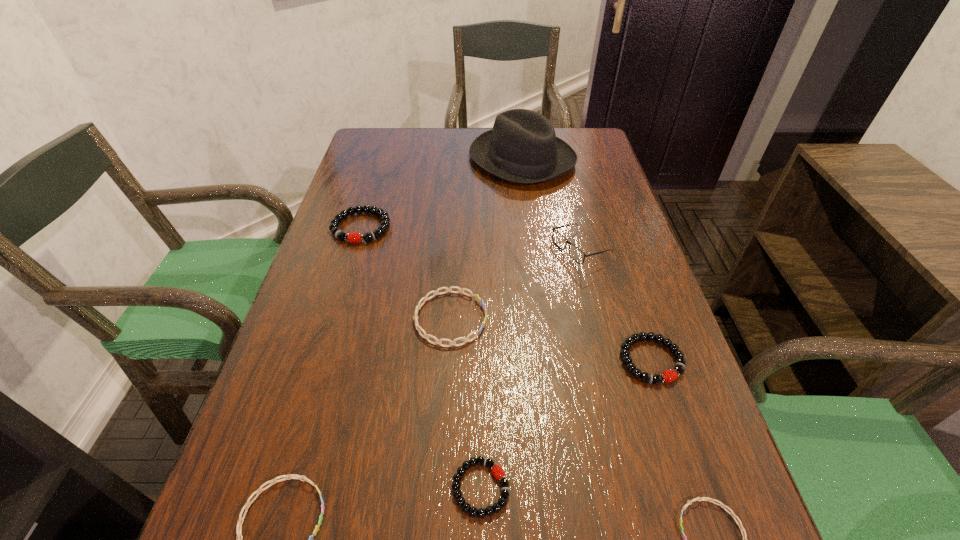
Locate an element on the screen. The width and height of the screenshot is (960, 540). empty location between the rightmost black bracelet and the second blue bracelet from right to left is located at coordinates (551, 340).

Where is `free space between the spectacles and the second smallest black bracelet`? The height and width of the screenshot is (540, 960). free space between the spectacles and the second smallest black bracelet is located at coordinates (615, 305).

Locate an element on the screen. Image resolution: width=960 pixels, height=540 pixels. free space between the second blue bracelet from right to left and the tallest object is located at coordinates (486, 239).

Locate which object is the closest to the second tallest object. Please provide its 2D coordinates. Your answer should be formatted as a tuple, i.e. [(x, y)], where the tuple contains the x and y coordinates of a point satisfying the conditions above.

[(426, 336)]

This screenshot has width=960, height=540. I want to click on the fifth closest object to the shortest bracelet, so click(291, 476).

The height and width of the screenshot is (540, 960). Find the location of `bracelet that is the sixth closest to the fedora`. bracelet that is the sixth closest to the fedora is located at coordinates (721, 504).

Where is `bracelet that is the second closest to the spectacles`? The width and height of the screenshot is (960, 540). bracelet that is the second closest to the spectacles is located at coordinates [668, 376].

Image resolution: width=960 pixels, height=540 pixels. I want to click on black bracelet that is the third closest to the fedora, so click(x=497, y=471).

Identify which black bracelet is the second nearest to the farthest bracelet. Please provide its 2D coordinates. Your answer should be formatted as a tuple, i.e. [(x, y)], where the tuple contains the x and y coordinates of a point satisfying the conditions above.

[(668, 376)]

This screenshot has height=540, width=960. I want to click on blue bracelet that is the third closest to the farthest object, so click(721, 504).